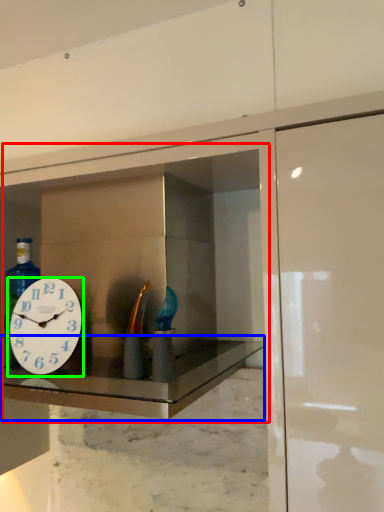
Question: Which is farther away from medicine cabinet (highlighted by a red box)? counter top (highlighted by a blue box) or wall clock (highlighted by a green box)?

Choices:
 (A) counter top
 (B) wall clock

Answer: (B)